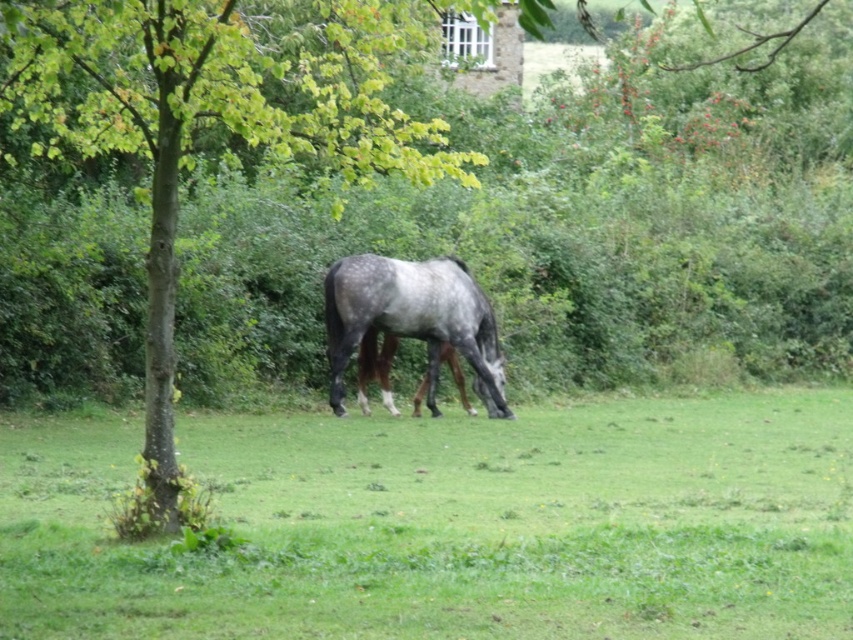
Who is lower down, green grass at center or speckled gray horse at center?

green grass at center is lower down.

Looking at this image, is green grass at center positioned before speckled gray horse at center?

Yes, it is in front of speckled gray horse at center.

Between point (830, 524) and point (463, 321), which one is positioned in front?

Point (830, 524) is in front.

This screenshot has height=640, width=853. In order to click on green grass at center in this screenshot , I will do `click(451, 524)`.

Is green leafy tree at center shorter than speckled gray horse at center?

Incorrect, green leafy tree at center's height does not fall short of speckled gray horse at center's.

This screenshot has height=640, width=853. What are the coordinates of `green leafy tree at center` in the screenshot? It's located at (207, 124).

Is point (177, 44) farther from camera compared to point (489, 410)?

That is False.

The image size is (853, 640). Find the location of `green leafy tree at center`. green leafy tree at center is located at coordinates (207, 124).

From the picture: Between green grass at center and green leafy tree at center, which one has less height?

With less height is green grass at center.

Which is in front, point (376, 516) or point (112, 33)?

Point (112, 33) is in front.

The image size is (853, 640). I want to click on green grass at center, so click(x=451, y=524).